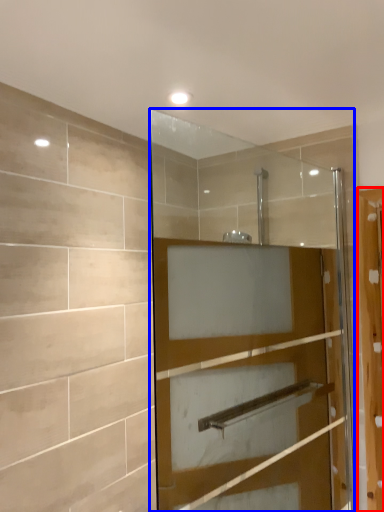
Question: Which object appears farthest to the camera in this image, screen door (highlighted by a red box) or door (highlighted by a blue box)?

Choices:
 (A) screen door
 (B) door

Answer: (A)